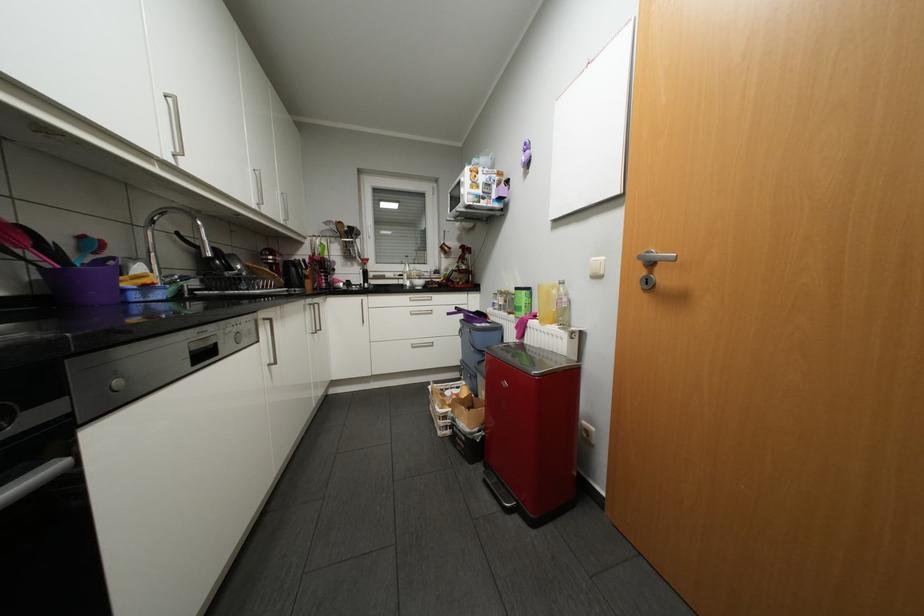
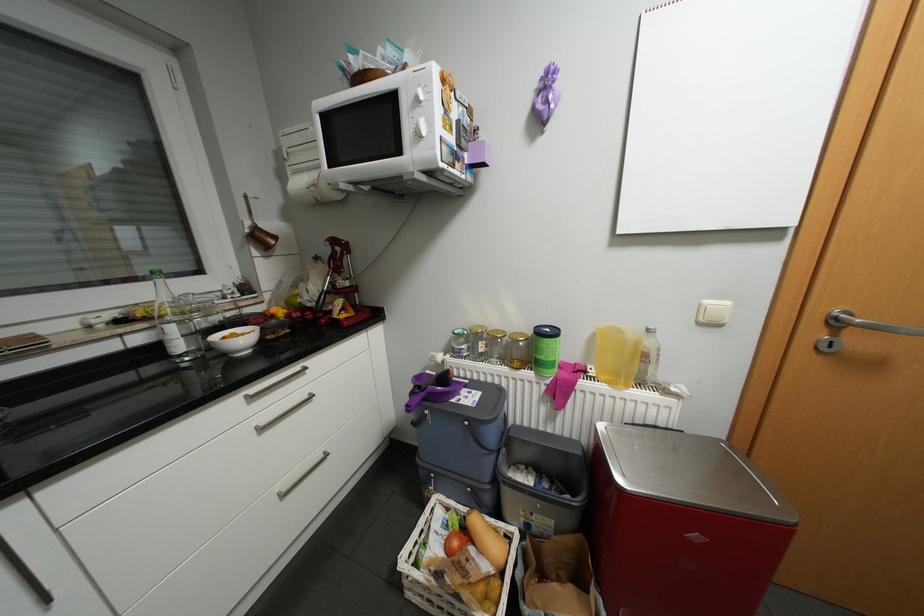
Find the pixel in the second image that matches [428,282] in the first image.

(249, 339)